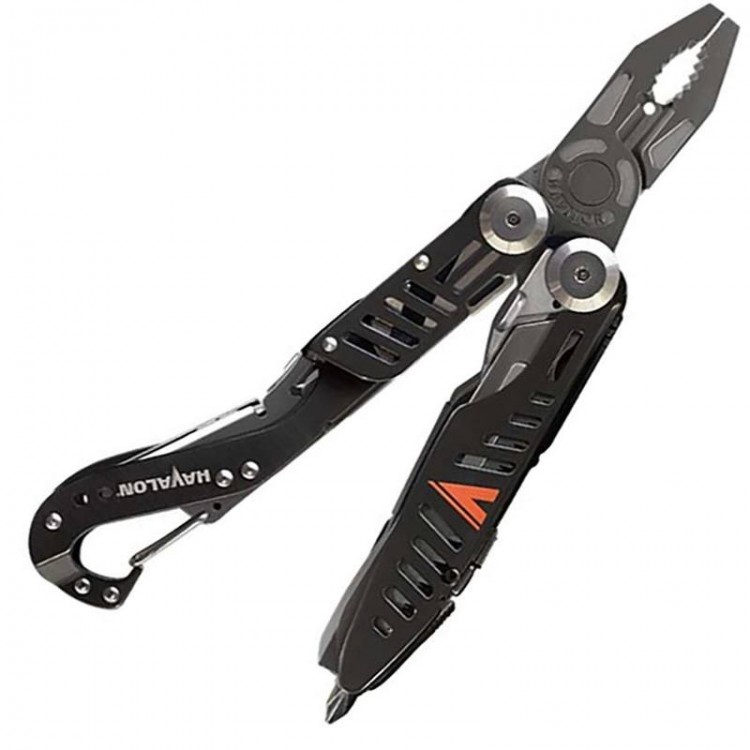
Locate an element on the screen. black handle is located at coordinates (502, 447).